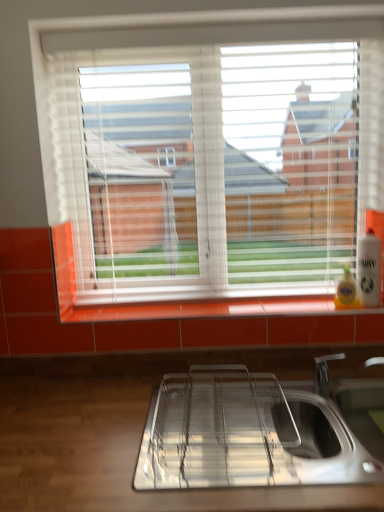
The image size is (384, 512). In order to click on empty space that is in between white plastic blinds at upper center and white plastic bottle at right in this screenshot , I will do `click(238, 304)`.